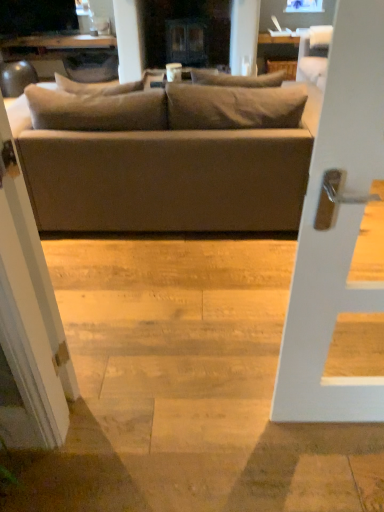
I want to click on vacant region in front of matte gray couch at center, so click(x=173, y=291).